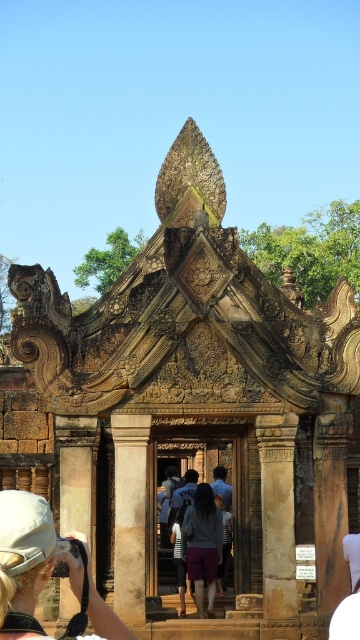
Question: Is white fabric at center smaller than dark gray fabric pants at center?

Choices:
 (A) yes
 (B) no

Answer: (B)

Question: Which point is farther to the camera?

Choices:
 (A) brown stone column at center
 (B) white fabric at center
 (C) dark gray fabric skirt at center

Answer: (C)

Question: Observing the image, what is the correct spatial positioning of brown stone pillar at center in reference to dark gray fabric skirt at center?

Choices:
 (A) below
 (B) above

Answer: (B)

Question: Can you confirm if brown stone pillar at center is positioned to the left of dark gray fabric skirt at center?

Choices:
 (A) no
 (B) yes

Answer: (B)

Question: Which point is closer to the camera taking this photo?

Choices:
 (A) (201, 484)
 (B) (15, 580)
 (C) (180, 531)

Answer: (B)

Question: Which object is positioned closest to the purple cotton shorts at center?

Choices:
 (A) dark gray fabric pants at center
 (B) brown stone pillar at center
 (C) dark gray fabric skirt at center
 (D) white fabric at center

Answer: (C)